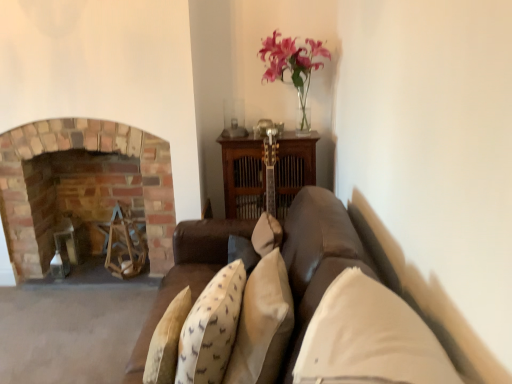
Question: Considering the relative sizes of white fabric pillow at center, which is the second pillow in left-to-right order, and brick fireplace at left in the image provided, is white fabric pillow at center, which is the second pillow in left-to-right order, thinner than brick fireplace at left?

Choices:
 (A) yes
 (B) no

Answer: (A)

Question: Is white fabric pillow at center, which ranks as the first pillow in right-to-left order, not inside brick fireplace at left?

Choices:
 (A) yes
 (B) no

Answer: (A)

Question: Considering the relative positions of white fabric pillow at center, which is the second pillow in left-to-right order, and brick fireplace at left in the image provided, is white fabric pillow at center, which is the second pillow in left-to-right order, behind brick fireplace at left?

Choices:
 (A) no
 (B) yes

Answer: (A)

Question: Considering the relative positions of white fabric pillow at center, which ranks as the first pillow in right-to-left order, and brick fireplace at left in the image provided, is white fabric pillow at center, which ranks as the first pillow in right-to-left order, to the left of brick fireplace at left from the viewer's perspective?

Choices:
 (A) yes
 (B) no

Answer: (B)

Question: From a real-world perspective, is white fabric pillow at center, which is the second pillow in left-to-right order, below brick fireplace at left?

Choices:
 (A) yes
 (B) no

Answer: (B)

Question: Can you confirm if white fabric pillow at center, which ranks as the first pillow in right-to-left order, is wider than brick fireplace at left?

Choices:
 (A) no
 (B) yes

Answer: (A)

Question: Is beige fabric pillow at center, the 2th pillow from the right, beside brick fireplace at left?

Choices:
 (A) no
 (B) yes

Answer: (A)

Question: Could you tell me if beige fabric pillow at center, placed as the 1th pillow when sorted from left to right, is facing brick fireplace at left?

Choices:
 (A) no
 (B) yes

Answer: (A)

Question: Can you confirm if beige fabric pillow at center, placed as the 1th pillow when sorted from left to right, is bigger than brick fireplace at left?

Choices:
 (A) yes
 (B) no

Answer: (B)

Question: Does beige fabric pillow at center, the 2th pillow from the right, have a greater height compared to brick fireplace at left?

Choices:
 (A) no
 (B) yes

Answer: (A)

Question: From a real-world perspective, is beige fabric pillow at center, placed as the 1th pillow when sorted from left to right, beneath brick fireplace at left?

Choices:
 (A) no
 (B) yes

Answer: (A)

Question: Does beige fabric pillow at center, placed as the 1th pillow when sorted from left to right, have a lesser height compared to brick fireplace at left?

Choices:
 (A) no
 (B) yes

Answer: (B)

Question: Considering the relative sizes of beige fabric pillow at center, placed as the 1th pillow when sorted from left to right, and white fabric pillow at center, which ranks as the first pillow in right-to-left order, in the image provided, is beige fabric pillow at center, placed as the 1th pillow when sorted from left to right, taller than white fabric pillow at center, which ranks as the first pillow in right-to-left order,?

Choices:
 (A) no
 (B) yes

Answer: (B)